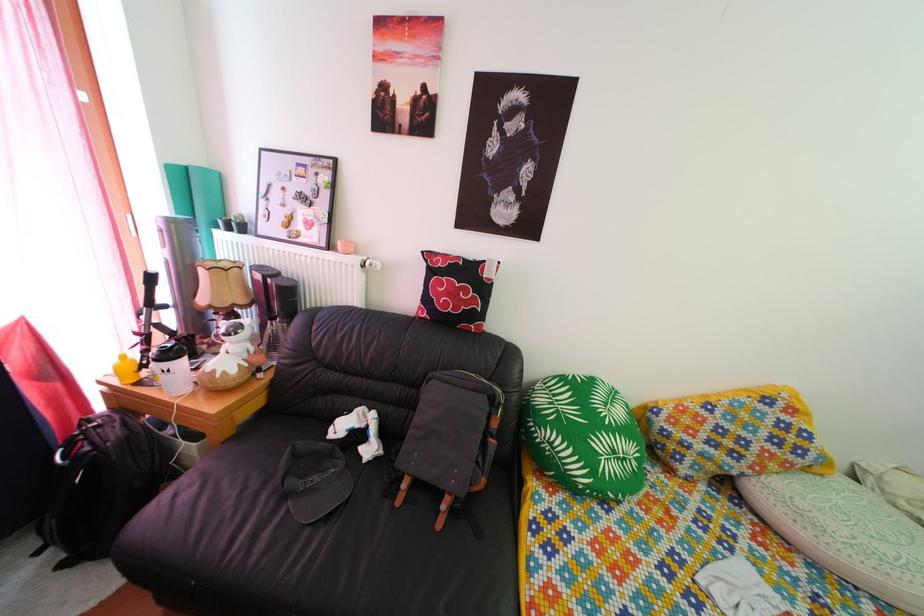
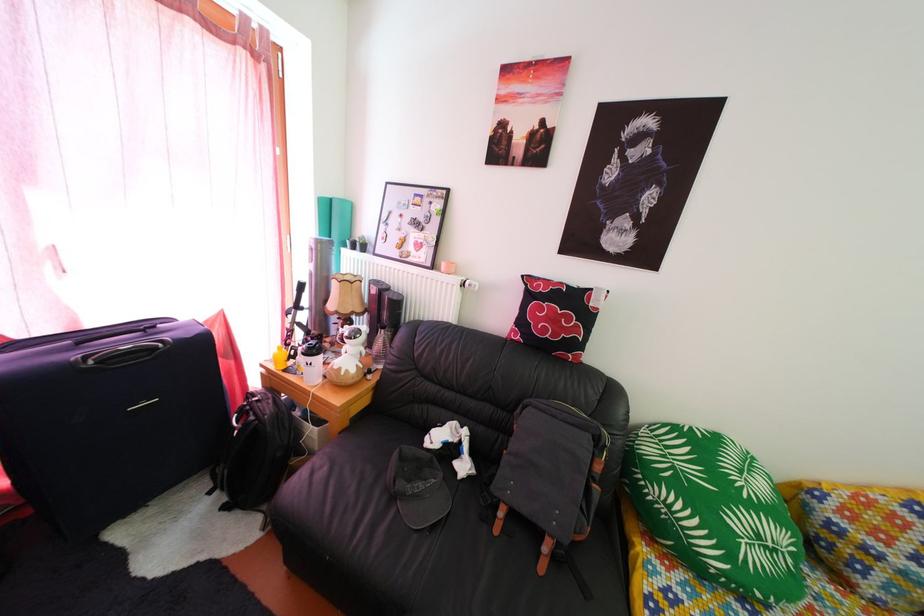
Question: Which direction would the cameraman need to move to produce the second image? Reply with the corresponding letter.

Choices:
 (A) Left
 (B) Right
 (C) Forward
 (D) Backward

Answer: (A)